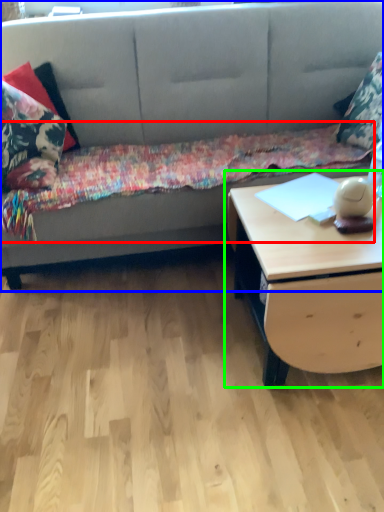
Question: Estimate the real-world distances between objects in this image. Which object is farther from blanket (highlighted by a red box), studio couch (highlighted by a blue box) or table (highlighted by a green box)?

Choices:
 (A) studio couch
 (B) table

Answer: (B)